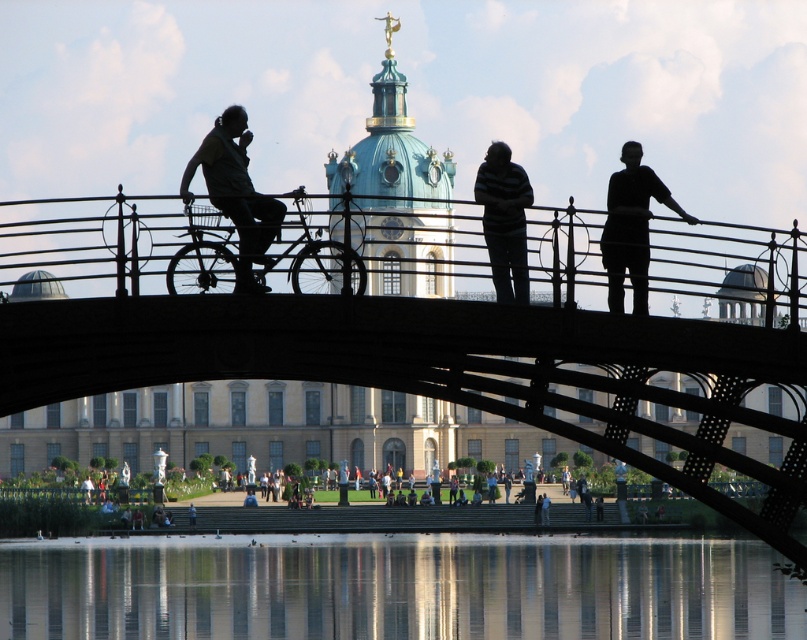
Can you confirm if black metal bridge at center is thinner than black matte person at right?

Incorrect, black metal bridge at center's width is not less than black matte person at right's.

Is black metal bridge at center below black matte person at right?

Yes.

Between point (805, 461) and point (642, 228), which one is positioned behind?

The point (805, 461) is more distant.

You are a GUI agent. You are given a task and a screenshot of the screen. Output one action in this format:
    pyautogui.click(x=<x>, y=<y>)
    Task: Click on the black metal bridge at center
    This screenshot has height=640, width=807.
    Given the screenshot: What is the action you would take?
    pyautogui.click(x=433, y=365)

Does point (57, 392) come closer to viewer compared to point (703, 627)?

Yes.

Which of these two, black metal bridge at center or transparent glass water at center, stands taller?

black metal bridge at center is taller.

Who is more distant from viewer, [396,305] or [389,579]?

The point [389,579] is behind.

You are a GUI agent. You are given a task and a screenshot of the screen. Output one action in this format:
    pyautogui.click(x=<x>, y=<y>)
    Task: Click on the black metal bridge at center
    
    Given the screenshot: What is the action you would take?
    pyautogui.click(x=433, y=365)

Does black metal bridge at center have a greater height compared to silhouette fabric-covered figure at left?

Indeed, black metal bridge at center has a greater height compared to silhouette fabric-covered figure at left.

Does black metal bridge at center appear on the right side of silhouette fabric-covered figure at left?

Indeed, black metal bridge at center is positioned on the right side of silhouette fabric-covered figure at left.

Identify the location of black metal bridge at center. The image size is (807, 640). (433, 365).